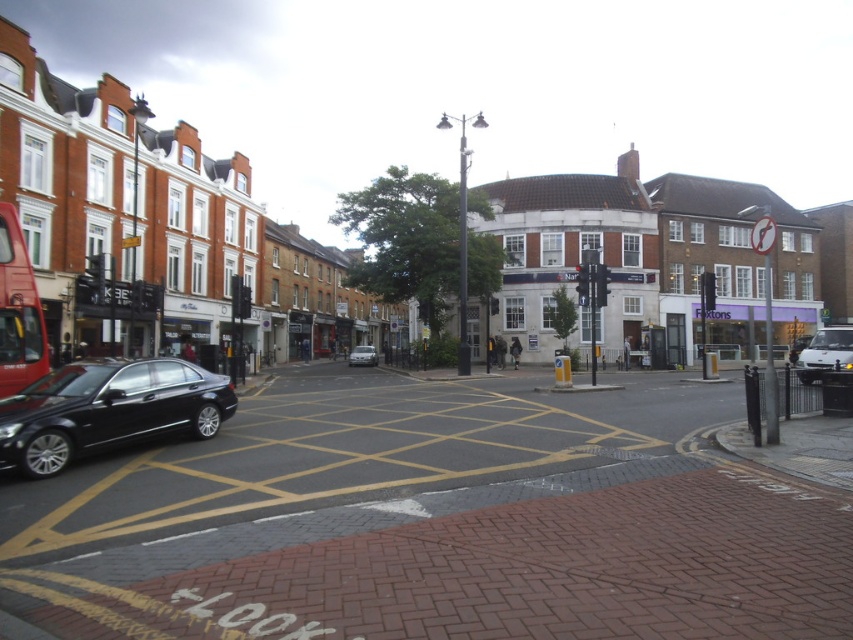
Question: Which point appears farthest from the camera in this image?

Choices:
 (A) (834, 332)
 (B) (0, 324)

Answer: (A)

Question: Does white matte van at right have a larger size compared to silver metallic car at center?

Choices:
 (A) yes
 (B) no

Answer: (A)

Question: Does matte red bus at left appear under white matte van at right?

Choices:
 (A) no
 (B) yes

Answer: (A)

Question: Considering the real-world distances, which object is closest to the silver metallic car at center?

Choices:
 (A) matte red bus at left
 (B) shiny black sedan at lower left

Answer: (A)

Question: Does white matte van at right have a larger size compared to silver metallic car at center?

Choices:
 (A) no
 (B) yes

Answer: (B)

Question: Which point appears farthest from the camera in this image?

Choices:
 (A) (368, 348)
 (B) (12, 337)
 (C) (824, 328)
 (D) (216, 378)

Answer: (A)